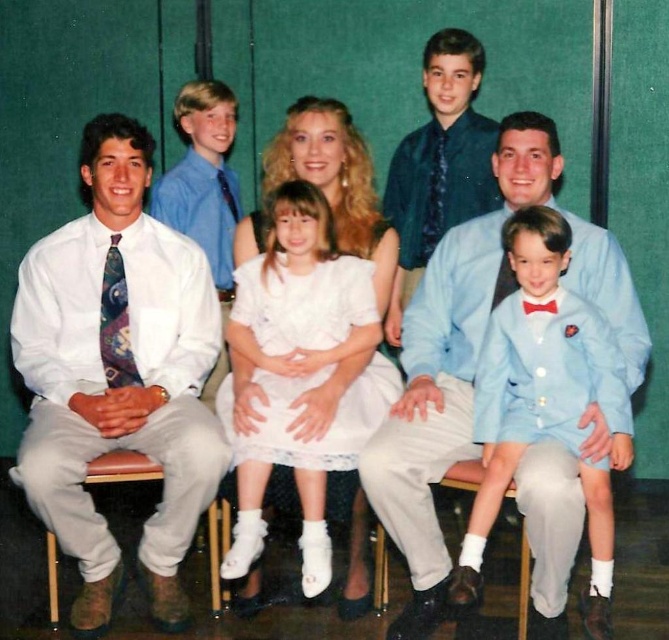
Question: Which of the following is the farthest from the observer?

Choices:
 (A) (470, 460)
 (B) (496, 488)
 (C) (169, 477)

Answer: (A)

Question: Considering the relative positions of brown leather chair at lower left and brown leather chair at lower right in the image provided, where is brown leather chair at lower left located with respect to brown leather chair at lower right?

Choices:
 (A) left
 (B) right

Answer: (A)

Question: Does white satin shirt at left come in front of light blue fabric suit at center?

Choices:
 (A) yes
 (B) no

Answer: (B)

Question: Which point appears closest to the camera in this image?

Choices:
 (A) (533, 273)
 (B) (456, 465)
 (C) (225, 508)

Answer: (A)

Question: Which object is farther from the camera taking this photo?

Choices:
 (A) white fabric chair at lower center
 (B) white lace dress at center
 (C) white satin shirt at left

Answer: (A)

Question: Can you confirm if white lace dress at center is smaller than white fabric chair at lower center?

Choices:
 (A) no
 (B) yes

Answer: (A)